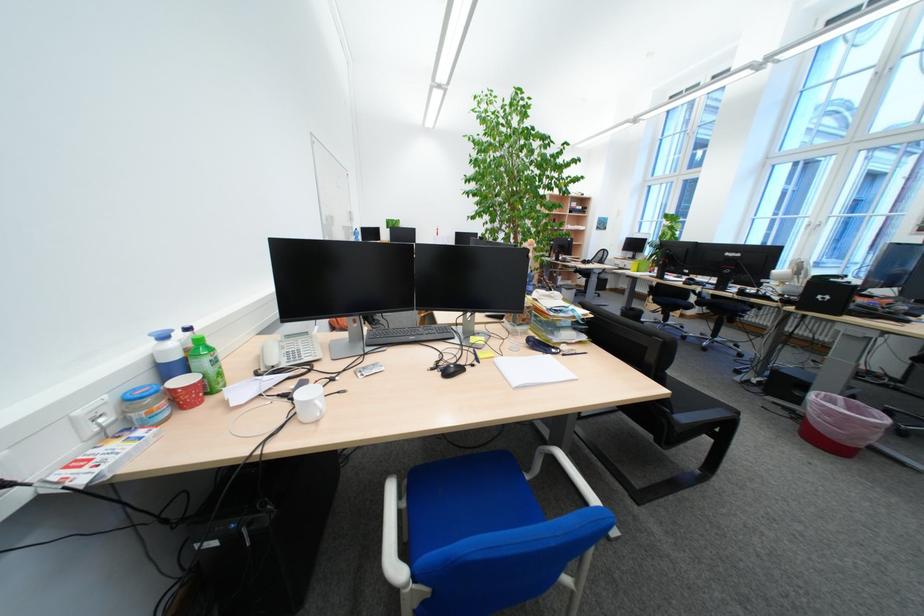
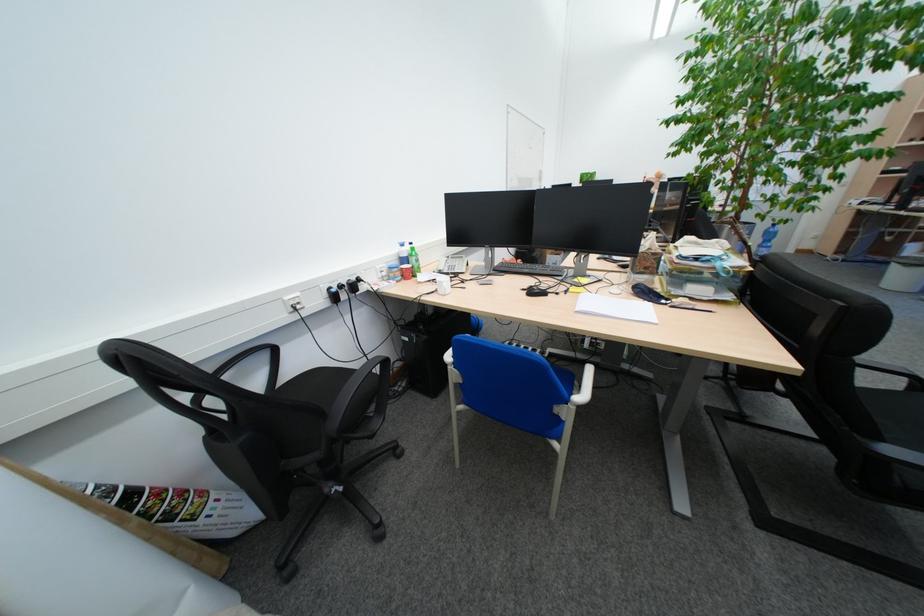
Locate, in the second image, the point that corresponds to point (188, 358) in the first image.

(417, 256)